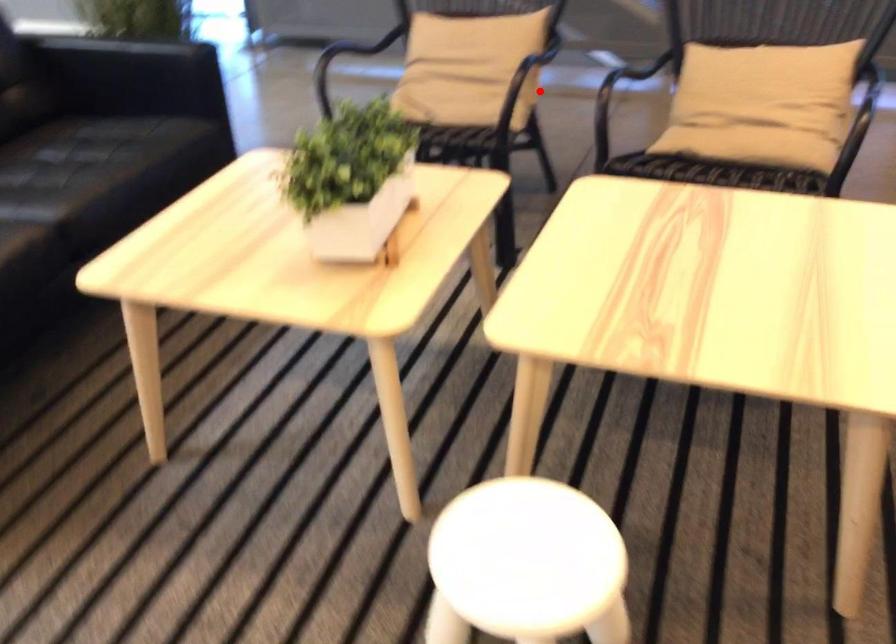
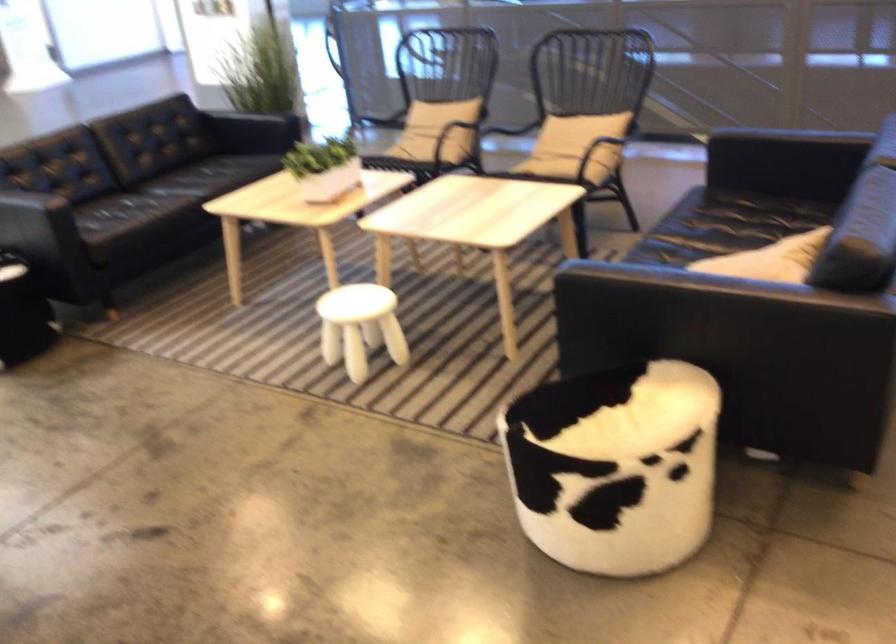
Question: I am providing you with two images of the same scene from different viewpoints. Given a red point in image1, look at the same physical point in image2. Is it:

Choices:
 (A) Closer to the viewpoint
 (B) Farther from the viewpoint

Answer: (B)